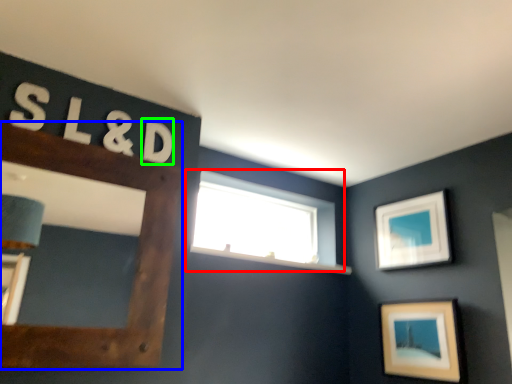
Question: Considering the real-world distances, which object is farthest from window (highlighted by a red box)? picture frame (highlighted by a blue box) or letter (highlighted by a green box)?

Choices:
 (A) picture frame
 (B) letter

Answer: (B)